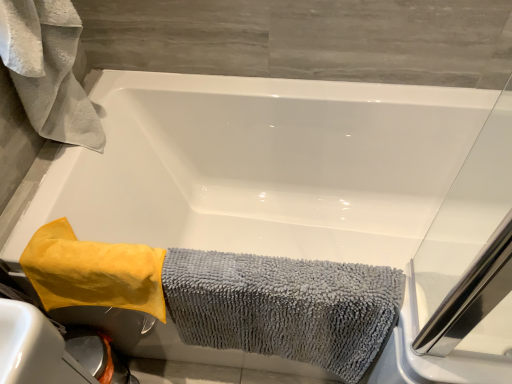
Find the location of a particular element. gray microfiber towel at lower left, positioned as the 1th bath towel in right-to-left order is located at coordinates (283, 307).

Describe the element at coordinates (283, 307) in the screenshot. I see `gray microfiber towel at lower left, which is the third bath towel from left to right` at that location.

From the picture: Measure the distance between yellow microfiber towel at lower left, the second bath towel viewed from the left, and camera.

The distance of yellow microfiber towel at lower left, the second bath towel viewed from the left, from camera is 34.70 inches.

At what (x,y) coordinates should I click in order to perform the action: click on white fluffy towel at upper left, which is the 3th bath towel in right-to-left order. Please return your answer as a coordinate pair (x, y). Looking at the image, I should click on (48, 69).

How many degrees apart are the facing directions of gray microfiber towel at lower left, positioned as the 1th bath towel in right-to-left order, and white fluffy towel at upper left, which appears as the 1th bath towel when viewed from the left?

There is a 90.5-degree angle between the facing directions of gray microfiber towel at lower left, positioned as the 1th bath towel in right-to-left order, and white fluffy towel at upper left, which appears as the 1th bath towel when viewed from the left.

Do you think gray microfiber towel at lower left, positioned as the 1th bath towel in right-to-left order, is within white fluffy towel at upper left, which appears as the 1th bath towel when viewed from the left, or outside of it?

gray microfiber towel at lower left, positioned as the 1th bath towel in right-to-left order, is not enclosed by white fluffy towel at upper left, which appears as the 1th bath towel when viewed from the left.

Looking at this image, which object is further away from the camera taking this photo, gray microfiber towel at lower left, positioned as the 1th bath towel in right-to-left order, or white fluffy towel at upper left, which is the 3th bath towel in right-to-left order?

gray microfiber towel at lower left, positioned as the 1th bath towel in right-to-left order, is behind.

Considering the positions of point (61, 245) and point (386, 329), is point (61, 245) closer or farther from the camera than point (386, 329)?

Point (61, 245) appears to be farther away from the viewer than point (386, 329).

Is yellow microfiber towel at lower left, which ranks as the second bath towel in right-to-left order, facing away from gray microfiber towel at lower left, which is the third bath towel from left to right?

No, yellow microfiber towel at lower left, which ranks as the second bath towel in right-to-left order, is not facing away from gray microfiber towel at lower left, which is the third bath towel from left to right.

Is yellow microfiber towel at lower left, the second bath towel viewed from the left, next to gray microfiber towel at lower left, which is the third bath towel from left to right, and touching it?

No, yellow microfiber towel at lower left, the second bath towel viewed from the left, is not touching gray microfiber towel at lower left, which is the third bath towel from left to right.

From the image's perspective, does yellow microfiber towel at lower left, the second bath towel viewed from the left, appear lower than gray microfiber towel at lower left, positioned as the 1th bath towel in right-to-left order?

No, from the image's perspective, yellow microfiber towel at lower left, the second bath towel viewed from the left, is not beneath gray microfiber towel at lower left, positioned as the 1th bath towel in right-to-left order.

In the scene shown: Is white fluffy towel at upper left, which appears as the 1th bath towel when viewed from the left, located outside gray microfiber towel at lower left, positioned as the 1th bath towel in right-to-left order?

Yes.

How different are the orientations of white fluffy towel at upper left, which is the 3th bath towel in right-to-left order, and gray microfiber towel at lower left, which is the third bath towel from left to right, in degrees?

90.5 degrees.

Looking at this image, from the image's perspective, does white fluffy towel at upper left, which is the 3th bath towel in right-to-left order, appear lower than gray microfiber towel at lower left, positioned as the 1th bath towel in right-to-left order?

Actually, white fluffy towel at upper left, which is the 3th bath towel in right-to-left order, appears above gray microfiber towel at lower left, positioned as the 1th bath towel in right-to-left order, in the image.

Does point (270, 291) come behind point (54, 290)?

No.

Between gray microfiber towel at lower left, positioned as the 1th bath towel in right-to-left order, and yellow microfiber towel at lower left, which ranks as the second bath towel in right-to-left order, which one has smaller size?

yellow microfiber towel at lower left, which ranks as the second bath towel in right-to-left order, is smaller.

Is gray microfiber towel at lower left, positioned as the 1th bath towel in right-to-left order, far from yellow microfiber towel at lower left, the second bath towel viewed from the left?

No, gray microfiber towel at lower left, positioned as the 1th bath towel in right-to-left order, is not far from yellow microfiber towel at lower left, the second bath towel viewed from the left.

Can white fluffy towel at upper left, which is the 3th bath towel in right-to-left order, be found inside yellow microfiber towel at lower left, the second bath towel viewed from the left?

No.

At what (x,y) coordinates should I click in order to perform the action: click on bath towel on the left of the yellow microfiber towel at lower left, the second bath towel viewed from the left. Please return your answer as a coordinate pair (x, y). Looking at the image, I should click on (48, 69).

From the image's perspective, is yellow microfiber towel at lower left, the second bath towel viewed from the left, positioned above or below white fluffy towel at upper left, which is the 3th bath towel in right-to-left order?

yellow microfiber towel at lower left, the second bath towel viewed from the left, is below white fluffy towel at upper left, which is the 3th bath towel in right-to-left order.

Is yellow microfiber towel at lower left, the second bath towel viewed from the left, placed right next to white fluffy towel at upper left, which appears as the 1th bath towel when viewed from the left?

No, yellow microfiber towel at lower left, the second bath towel viewed from the left, is not beside white fluffy towel at upper left, which appears as the 1th bath towel when viewed from the left.

From a real-world perspective, which is physically below, white fluffy towel at upper left, which is the 3th bath towel in right-to-left order, or yellow microfiber towel at lower left, which ranks as the second bath towel in right-to-left order?

From a 3D spatial view, yellow microfiber towel at lower left, which ranks as the second bath towel in right-to-left order, is below.

Which is correct: white fluffy towel at upper left, which appears as the 1th bath towel when viewed from the left, is inside yellow microfiber towel at lower left, the second bath towel viewed from the left, or outside of it?

white fluffy towel at upper left, which appears as the 1th bath towel when viewed from the left, is located beyond the bounds of yellow microfiber towel at lower left, the second bath towel viewed from the left.

This screenshot has height=384, width=512. I want to click on bath towel that appears in front of the gray microfiber towel at lower left, which is the third bath towel from left to right, so point(48,69).

Identify the location of bath towel located below the yellow microfiber towel at lower left, the second bath towel viewed from the left (from the image's perspective). The width and height of the screenshot is (512, 384). [x=283, y=307].

When comparing their distances from yellow microfiber towel at lower left, which ranks as the second bath towel in right-to-left order, does gray microfiber towel at lower left, positioned as the 1th bath towel in right-to-left order, or white fluffy towel at upper left, which appears as the 1th bath towel when viewed from the left, seem closer?

The object closer to yellow microfiber towel at lower left, which ranks as the second bath towel in right-to-left order, is gray microfiber towel at lower left, positioned as the 1th bath towel in right-to-left order.

From the image, which object appears to be nearer to gray microfiber towel at lower left, positioned as the 1th bath towel in right-to-left order, yellow microfiber towel at lower left, which ranks as the second bath towel in right-to-left order, or white fluffy towel at upper left, which appears as the 1th bath towel when viewed from the left?

yellow microfiber towel at lower left, which ranks as the second bath towel in right-to-left order, lies closer to gray microfiber towel at lower left, positioned as the 1th bath towel in right-to-left order, than the other object.

Based on their spatial positions, is white fluffy towel at upper left, which is the 3th bath towel in right-to-left order, or yellow microfiber towel at lower left, the second bath towel viewed from the left, further from gray microfiber towel at lower left, positioned as the 1th bath towel in right-to-left order?

Among the two, white fluffy towel at upper left, which is the 3th bath towel in right-to-left order, is located further to gray microfiber towel at lower left, positioned as the 1th bath towel in right-to-left order.

Which object lies nearer to the anchor point yellow microfiber towel at lower left, the second bath towel viewed from the left, white fluffy towel at upper left, which is the 3th bath towel in right-to-left order, or gray microfiber towel at lower left, positioned as the 1th bath towel in right-to-left order?

gray microfiber towel at lower left, positioned as the 1th bath towel in right-to-left order, is closer to yellow microfiber towel at lower left, the second bath towel viewed from the left.

From the picture: When comparing their distances from white fluffy towel at upper left, which appears as the 1th bath towel when viewed from the left, does gray microfiber towel at lower left, which is the third bath towel from left to right, or yellow microfiber towel at lower left, the second bath towel viewed from the left, seem further?

gray microfiber towel at lower left, which is the third bath towel from left to right, is further to white fluffy towel at upper left, which appears as the 1th bath towel when viewed from the left.

From the image, which object appears to be farther from white fluffy towel at upper left, which is the 3th bath towel in right-to-left order, yellow microfiber towel at lower left, the second bath towel viewed from the left, or gray microfiber towel at lower left, which is the third bath towel from left to right?

gray microfiber towel at lower left, which is the third bath towel from left to right, is further to white fluffy towel at upper left, which is the 3th bath towel in right-to-left order.

The width and height of the screenshot is (512, 384). In order to click on bath towel between white fluffy towel at upper left, which appears as the 1th bath towel when viewed from the left, and gray microfiber towel at lower left, which is the third bath towel from left to right, vertically in this screenshot , I will do `click(93, 272)`.